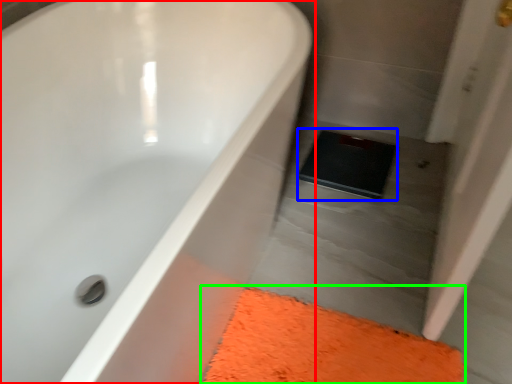
Question: Estimate the real-world distances between objects in this image. Which object is closer to bathtub (highlighted by a red box), pad (highlighted by a blue box) or bath mat (highlighted by a green box)?

Choices:
 (A) pad
 (B) bath mat

Answer: (B)